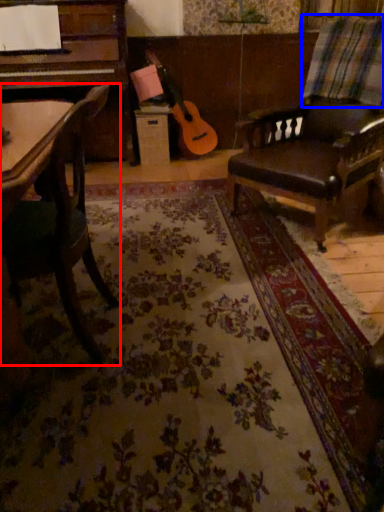
Question: Which of the following is the closest to the observer, chair (highlighted by a red box) or plaid (highlighted by a blue box)?

Choices:
 (A) chair
 (B) plaid

Answer: (A)